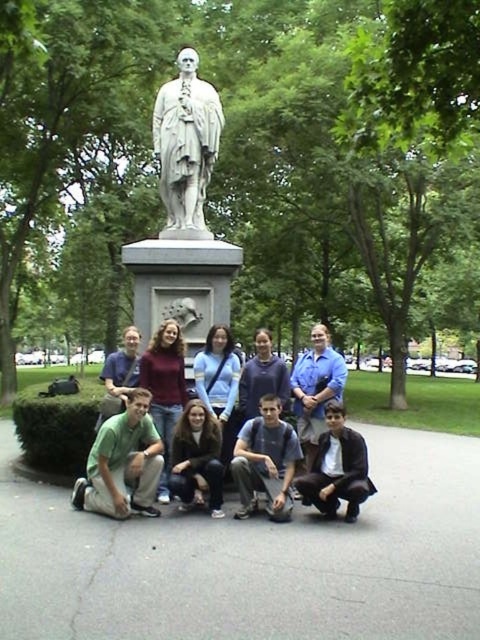
You are standing at the location where the viewer is positioned in the image. You want to hand a small gift to someone wearing blue denim jeans at center. Considering the distance between you and them, can you throw the gift to them without moving from your current position?

The blue denim jeans at center and viewer are 6.68 meters apart from each other. Throwing a gift over 6.68 meters might be challenging for an average person, so it is not advisable to attempt without moving closer.

You are a photographer trying to capture a clear shot of the matte blue shirt at center and the dark blue shirt at center. Which one is closer to the camera?

The matte blue shirt at center is closer to the camera than the dark blue shirt at center.

You are a photographer trying to adjust the focus on your camera. You want to ensure both the dark blue shirt at center and the dark brown hair at center are in focus. Given their positions, which one should you focus on first to achieve this?

The dark blue shirt at center is closer to the viewer than the dark brown hair at center. To ensure both are in focus, you should focus on the dark brown hair at center first, as it is farther away, allowing the depth of field to cover both subjects.